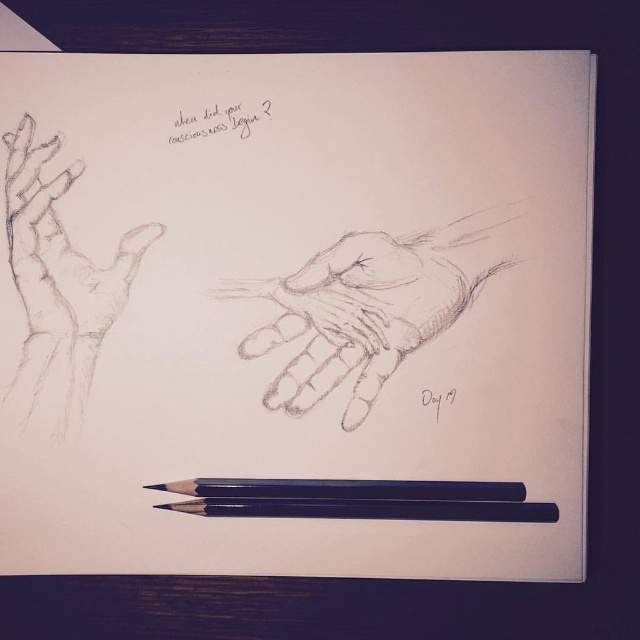
You are an art student who wants to know which object in the image is taller. You see the graphite sketch hand at upper left and the black smooth pencil at bottom. Which one is taller?

The graphite sketch hand at upper left is much taller than the black smooth pencil at bottom.

You are an art student who wants to compare the sizes of the graphite sketch hand at upper left and the black smooth pencil at bottom for a project. Which object is wider?

The graphite sketch hand at upper left is less than the black smooth pencil at bottom in width, so the black smooth pencil at bottom is wider.

You are an art student analyzing the composition of the sketchbook page. The graphite sketch hand at upper left and the handwritten text above the sketches are both present. Based on their positions, which object is closer to the top edge of the page?

The handwritten text above the sketches is closer to the top edge of the page because the graphite sketch hand at upper left is located at point (58, 276), which is lower than the position of the text.